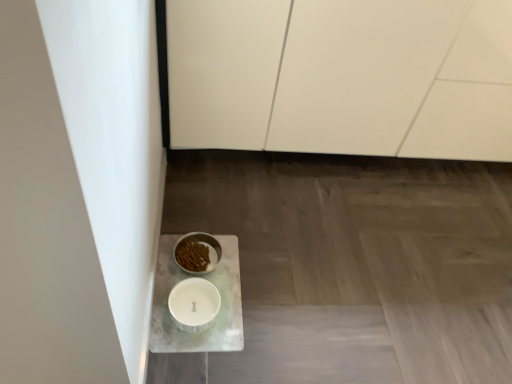
Question: From the image's perspective, is white marble tray at lower left located above white matte cabinet at upper center?

Choices:
 (A) yes
 (B) no

Answer: (B)

Question: From the image's perspective, would you say white marble tray at lower left is shown under white matte cabinet at upper center?

Choices:
 (A) yes
 (B) no

Answer: (A)

Question: Is white marble tray at lower left aimed at white matte cabinet at upper center?

Choices:
 (A) yes
 (B) no

Answer: (B)

Question: From a real-world perspective, is white marble tray at lower left under white matte cabinet at upper center?

Choices:
 (A) yes
 (B) no

Answer: (A)

Question: Considering the relative sizes of white marble tray at lower left and white matte cabinet at upper center in the image provided, is white marble tray at lower left wider than white matte cabinet at upper center?

Choices:
 (A) no
 (B) yes

Answer: (B)

Question: Do you think white glossy bowl at lower left, arranged as the first tableware when ordered from the bottom, is within white matte cabinet at upper center, or outside of it?

Choices:
 (A) inside
 (B) outside

Answer: (B)

Question: From a real-world perspective, relative to white matte cabinet at upper center, is white glossy bowl at lower left, which ranks as the 2th tableware in top-to-bottom order, vertically above or below?

Choices:
 (A) below
 (B) above

Answer: (A)

Question: Considering the positions of white glossy bowl at lower left, arranged as the first tableware when ordered from the bottom, and white matte cabinet at upper center in the image, is white glossy bowl at lower left, arranged as the first tableware when ordered from the bottom, wider or thinner than white matte cabinet at upper center?

Choices:
 (A) thin
 (B) wide

Answer: (A)

Question: From the image's perspective, relative to white matte cabinet at upper center, is white glossy bowl at lower left, which ranks as the 2th tableware in top-to-bottom order, above or below?

Choices:
 (A) above
 (B) below

Answer: (B)

Question: Is white matte cabinet at upper center in front of or behind white marble tray at lower left in the image?

Choices:
 (A) front
 (B) behind

Answer: (B)

Question: Considering the positions of point (338, 71) and point (302, 294), is point (338, 71) closer or farther from the camera than point (302, 294)?

Choices:
 (A) closer
 (B) farther

Answer: (B)

Question: Is white matte cabinet at upper center situated inside white marble tray at lower left or outside?

Choices:
 (A) outside
 (B) inside

Answer: (A)

Question: From a real-world perspective, is white matte cabinet at upper center above or below white marble tray at lower left?

Choices:
 (A) below
 (B) above

Answer: (B)

Question: Considering the positions of point (322, 349) and point (261, 61), is point (322, 349) closer or farther from the camera than point (261, 61)?

Choices:
 (A) closer
 (B) farther

Answer: (A)

Question: Considering the positions of white marble tray at lower left and white matte cabinet at upper center in the image, is white marble tray at lower left bigger or smaller than white matte cabinet at upper center?

Choices:
 (A) small
 (B) big

Answer: (A)